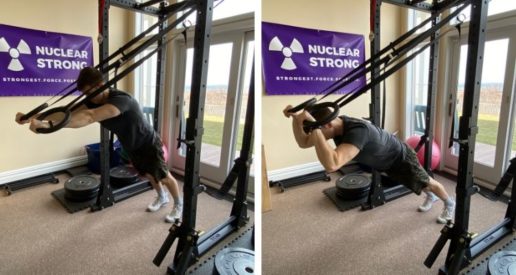
Identify the location of wall. The width and height of the screenshot is (516, 275). [349, 13].